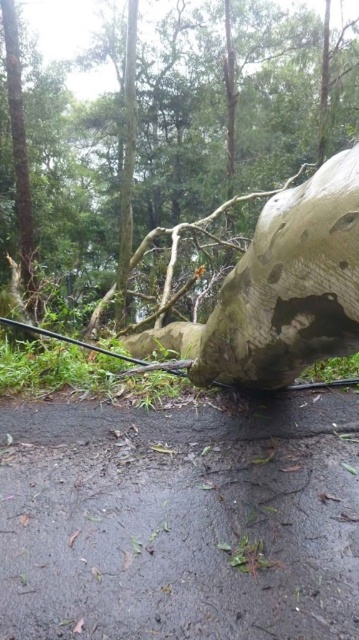
Where is `green rough bark tree at center`? This screenshot has width=359, height=640. green rough bark tree at center is located at coordinates (185, 140).

Who is positioned more to the right, greenish-brown rough bark stump at center or green rough bark at left?

From the viewer's perspective, greenish-brown rough bark stump at center appears more on the right side.

Is greenish-brown rough bark stump at center thinner than green rough bark at left?

Yes.

Describe the element at coordinates (290, 285) in the screenshot. I see `greenish-brown rough bark stump at center` at that location.

The height and width of the screenshot is (640, 359). I want to click on greenish-brown rough bark stump at center, so click(x=290, y=285).

Between green rough bark tree at center and green rough bark at left, which one appears on the right side from the viewer's perspective?

green rough bark tree at center

From the picture: Does green rough bark tree at center appear over green rough bark at left?

Yes, green rough bark tree at center is above green rough bark at left.

Describe the element at coordinates (185, 140) in the screenshot. I see `green rough bark tree at center` at that location.

This screenshot has height=640, width=359. In order to click on green rough bark tree at center in this screenshot , I will do coord(185,140).